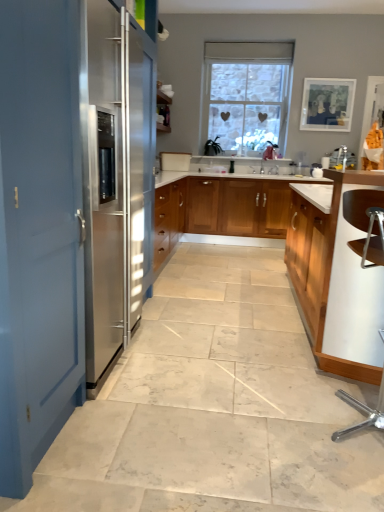
Question: From the image's perspective, would you say light wood/wooden cabinet at right, which ranks as the 1th cabinetry in front-to-back order, is positioned over wooden cabinet at center, positioned as the first cabinetry in back-to-front order?

Choices:
 (A) no
 (B) yes

Answer: (A)

Question: Does light wood/wooden cabinet at right, arranged as the second cabinetry when viewed from the back, have a smaller size compared to wooden cabinet at center, which is counted as the second cabinetry, starting from the front?

Choices:
 (A) no
 (B) yes

Answer: (A)

Question: Would you consider light wood/wooden cabinet at right, arranged as the second cabinetry when viewed from the back, to be distant from wooden cabinet at center, which is counted as the second cabinetry, starting from the front?

Choices:
 (A) no
 (B) yes

Answer: (B)

Question: Considering the relative positions of light wood/wooden cabinet at right, arranged as the second cabinetry when viewed from the back, and wooden cabinet at center, which is counted as the second cabinetry, starting from the front, in the image provided, is light wood/wooden cabinet at right, arranged as the second cabinetry when viewed from the back, in front of wooden cabinet at center, which is counted as the second cabinetry, starting from the front,?

Choices:
 (A) no
 (B) yes

Answer: (B)

Question: Is light wood/wooden cabinet at right, which ranks as the 1th cabinetry in front-to-back order, surrounding wooden cabinet at center, positioned as the first cabinetry in back-to-front order?

Choices:
 (A) no
 (B) yes

Answer: (A)

Question: Does light wood/wooden cabinet at right, arranged as the second cabinetry when viewed from the back, have a greater width compared to wooden cabinet at center, which is counted as the second cabinetry, starting from the front?

Choices:
 (A) no
 (B) yes

Answer: (B)

Question: From the image's perspective, is stone textured window at center under wooden cabinet at center, which is counted as the second cabinetry, starting from the front?

Choices:
 (A) no
 (B) yes

Answer: (A)

Question: Could you tell me if stone textured window at center is turned towards wooden cabinet at center, positioned as the first cabinetry in back-to-front order?

Choices:
 (A) no
 (B) yes

Answer: (A)

Question: Considering the relative sizes of stone textured window at center and wooden cabinet at center, positioned as the first cabinetry in back-to-front order, in the image provided, is stone textured window at center thinner than wooden cabinet at center, positioned as the first cabinetry in back-to-front order,?

Choices:
 (A) no
 (B) yes

Answer: (B)

Question: Are stone textured window at center and wooden cabinet at center, positioned as the first cabinetry in back-to-front order, located far from each other?

Choices:
 (A) no
 (B) yes

Answer: (B)

Question: Is wooden cabinet at center, positioned as the first cabinetry in back-to-front order, at the back of stone textured window at center?

Choices:
 (A) no
 (B) yes

Answer: (A)

Question: Is stone textured window at center located outside wooden cabinet at center, positioned as the first cabinetry in back-to-front order?

Choices:
 (A) yes
 (B) no

Answer: (A)

Question: Is stone textured window at center far from blue matte door at left?

Choices:
 (A) yes
 (B) no

Answer: (A)